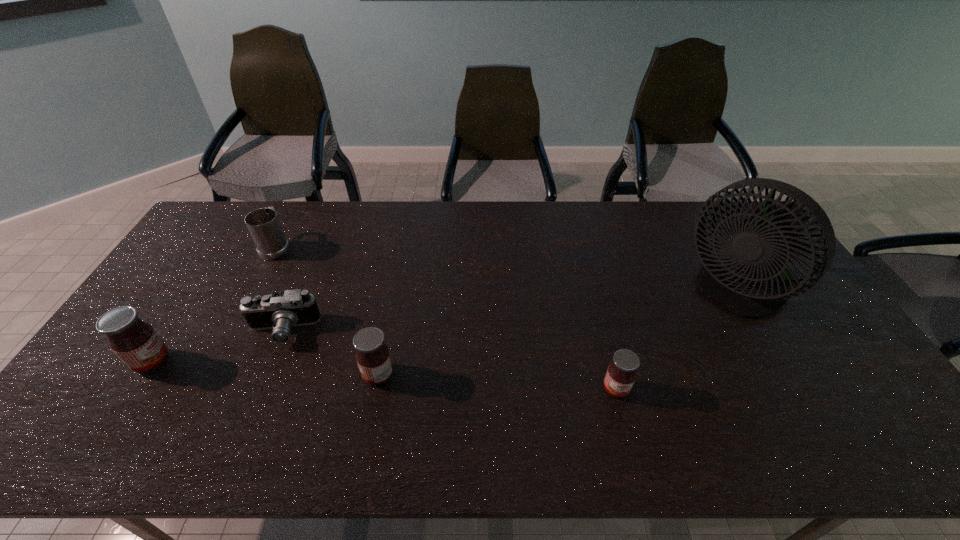
Please point a vacant point for placing a jam on the right. Please provide its 2D coordinates. Your answer should be formatted as a tuple, i.e. [(x, y)], where the tuple contains the x and y coordinates of a point satisfying the conditions above.

[(867, 404)]